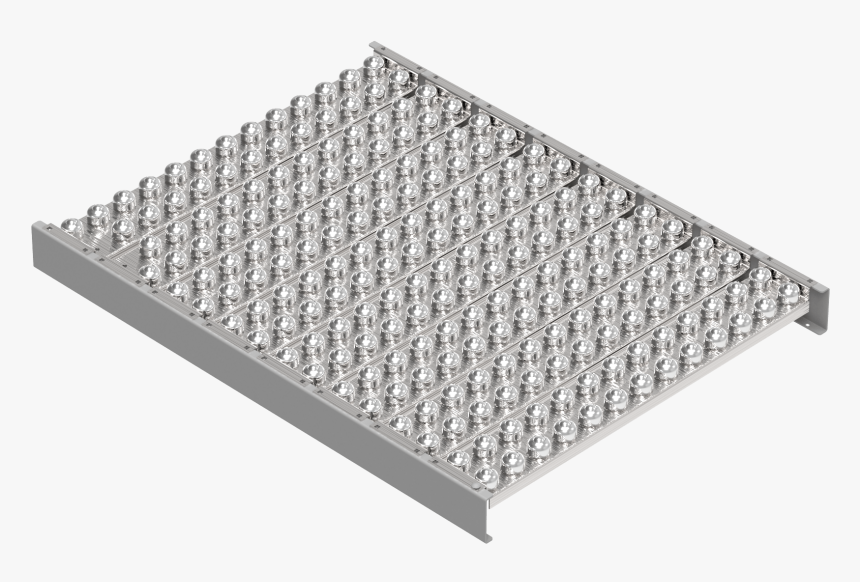
Locate an element on the screen. This screenshot has width=860, height=582. corners is located at coordinates (470, 496), (47, 239), (385, 49), (820, 307).